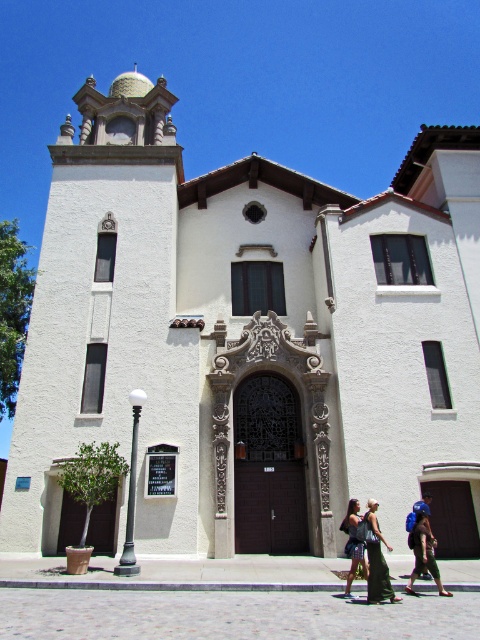
Is point (372, 513) less distant than point (432, 568)?

No, it is behind (432, 568).

Is green fabric dress at lower center bigger than blue fabric backpack at center?

No.

Is point (375, 580) behind point (444, 592)?

No, (375, 580) is closer to viewer.

Locate an element on the screen. Image resolution: width=480 pixels, height=640 pixels. green fabric dress at lower center is located at coordinates (376, 561).

What do you see at coordinates (376, 561) in the screenshot?
I see `green fabric dress at lower center` at bounding box center [376, 561].

Between point (369, 545) and point (363, 573), which one is positioned behind?

The point (363, 573) is more distant.

Image resolution: width=480 pixels, height=640 pixels. Find the location of `green fabric dress at lower center`. green fabric dress at lower center is located at coordinates (376, 561).

Is point (359, 548) positioned behind point (422, 496)?

No, (359, 548) is closer to viewer.

Can you confirm if dark blue denim jeans at center is bigger than blue backpack at center?

Yes.

Which is in front, point (347, 596) or point (411, 518)?

Point (347, 596)

Find the location of `dark blue denim jeans at center`. dark blue denim jeans at center is located at coordinates (354, 545).